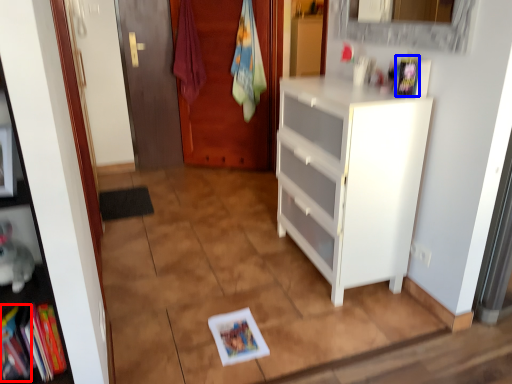
Question: Which point is further to the camera, book (highlighted by a red box) or book (highlighted by a blue box)?

Choices:
 (A) book
 (B) book

Answer: (B)